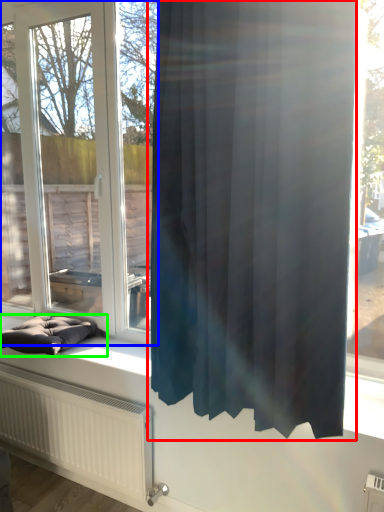
Question: Which is nearer to the curtain (highlighted by a red box)? window (highlighted by a blue box) or furniture (highlighted by a green box).

Choices:
 (A) window
 (B) furniture

Answer: (B)